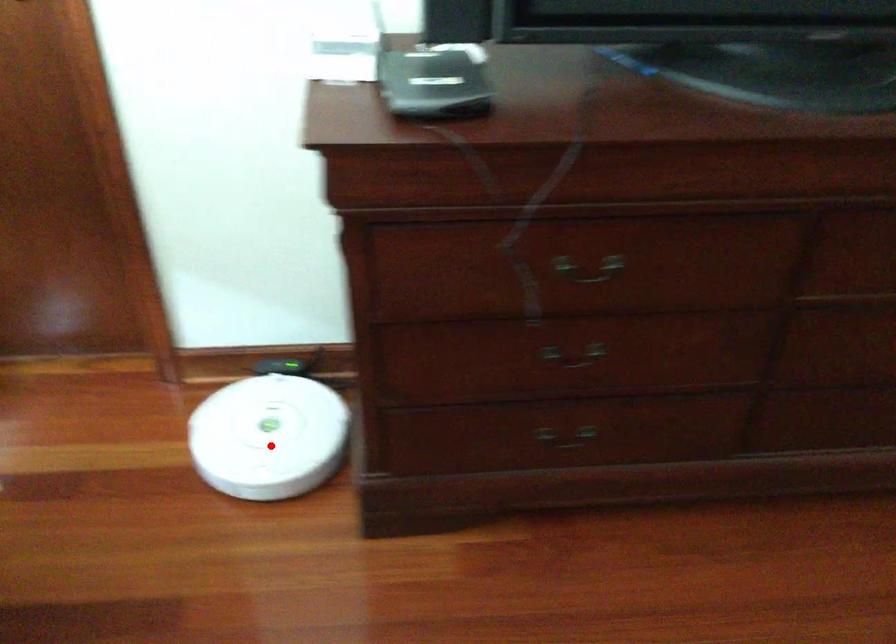
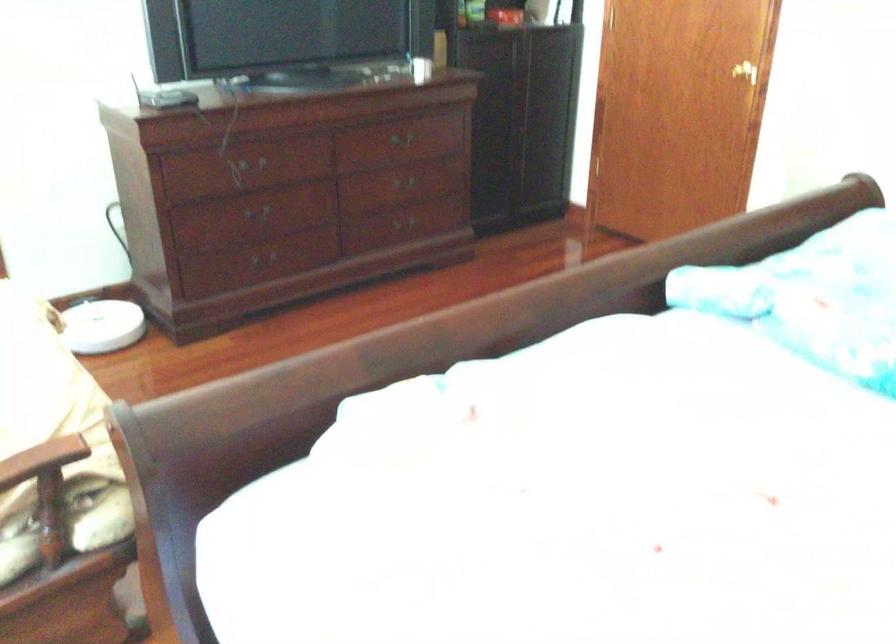
Locate, in the second image, the point that corresponds to the highlighted location in the first image.

(101, 326)